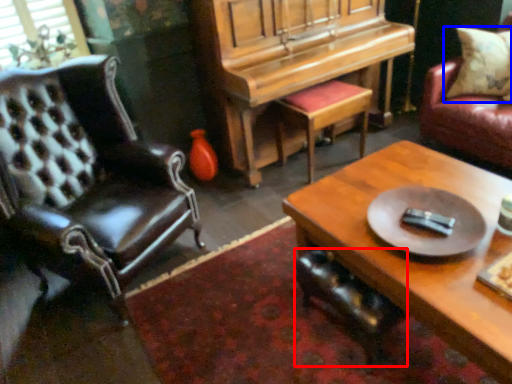
Question: Which of the following is the closest to the observer, chair (highlighted by a red box) or pillow (highlighted by a blue box)?

Choices:
 (A) chair
 (B) pillow

Answer: (A)